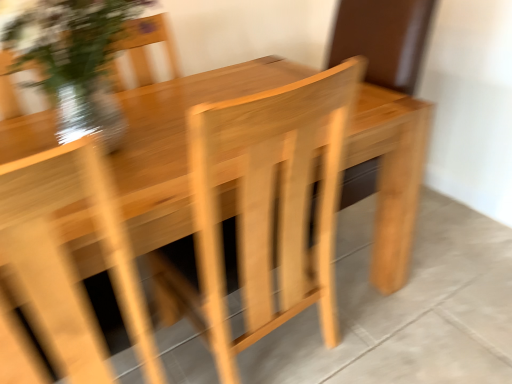
Question: From a real-world perspective, is translucent glass vase at upper left above or below natural wood table at center?

Choices:
 (A) below
 (B) above

Answer: (B)

Question: In terms of size, does translucent glass vase at upper left appear bigger or smaller than natural wood table at center?

Choices:
 (A) big
 (B) small

Answer: (B)

Question: Which of these objects is positioned farthest from the natural wood table at center?

Choices:
 (A) translucent glass vase at upper left
 (B) natural wood table at center
 (C) natural wood armchair at center

Answer: (B)

Question: Which object is positioned farthest from the translucent glass vase at upper left?

Choices:
 (A) natural wood table at center
 (B) natural wood armchair at center
 (C) natural wood table at center

Answer: (A)